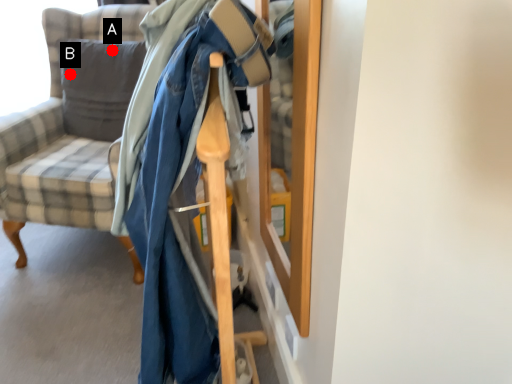
Question: Two points are circled on the image, labeled by A and B beside each circle. Which of the following is the closest to the observer?

Choices:
 (A) A is closer
 (B) B is closer

Answer: (A)